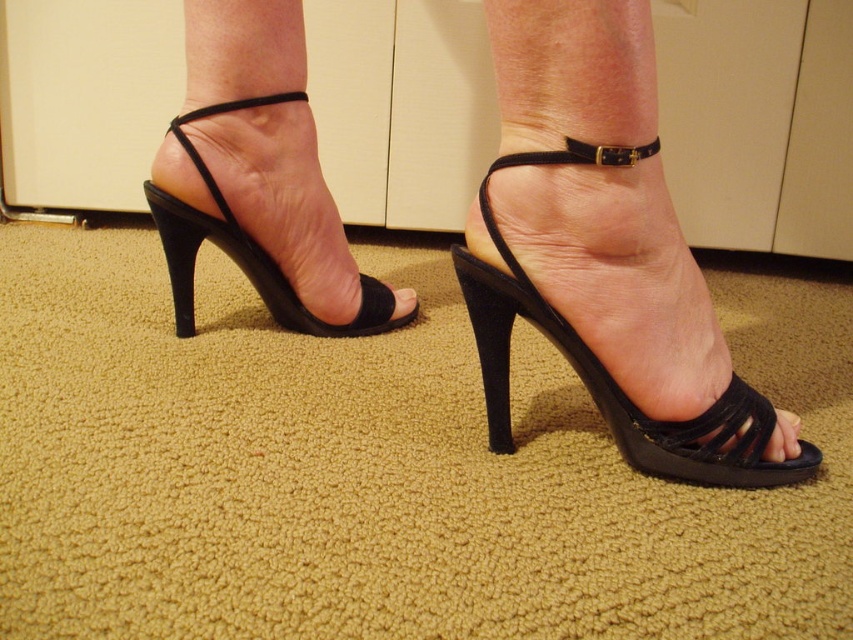
Question: Which is nearer to the suede black sandal at center?

Choices:
 (A) suede black high-heeled sandal at left
 (B) suede black high-heeled sandals at center

Answer: (B)

Question: Does suede black high-heeled sandals at center have a greater width compared to suede black high-heeled sandal at left?

Choices:
 (A) no
 (B) yes

Answer: (A)

Question: Is suede black high-heeled sandals at center positioned in front of suede black high-heeled sandal at left?

Choices:
 (A) yes
 (B) no

Answer: (A)

Question: Which point is closer to the camera?

Choices:
 (A) (646, 84)
 (B) (322, 324)

Answer: (A)

Question: Does suede black high-heeled sandals at center appear on the left side of suede black high-heeled sandal at left?

Choices:
 (A) yes
 (B) no

Answer: (B)

Question: Among these objects, which one is nearest to the camera?

Choices:
 (A) suede black high-heeled sandal at left
 (B) suede black sandal at center

Answer: (B)